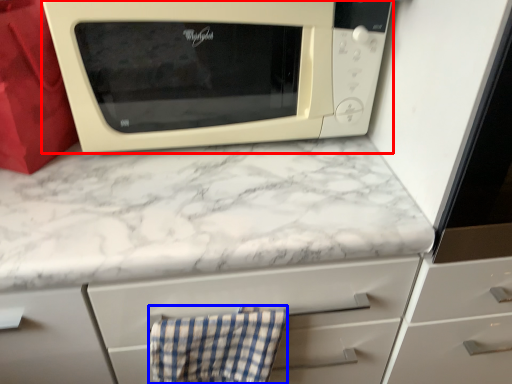
Question: Which object is further to the camera taking this photo, microwave oven (highlighted by a red box) or hand towel (highlighted by a blue box)?

Choices:
 (A) microwave oven
 (B) hand towel

Answer: (B)